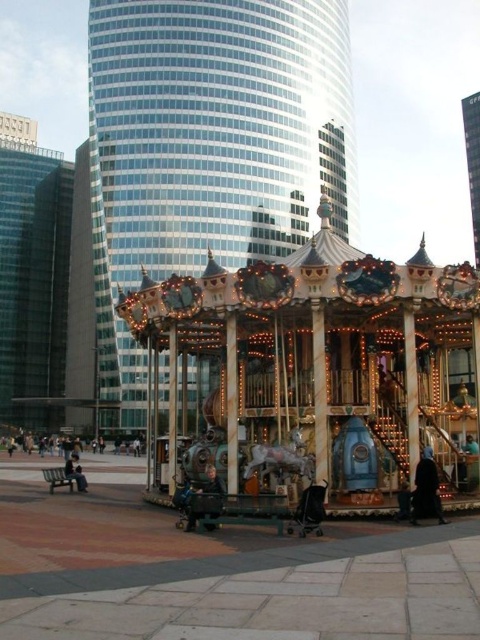
Question: Which object is positioned farthest from the dark blue fabric chair at center?

Choices:
 (A) dark blue jeans at lower left
 (B) wooden carousel at center
 (C) black fur coat at lower right
 (D) glassy skyscraper at left

Answer: (D)

Question: Is the position of glassy skyscraper at left less distant than that of dark blue fabric chair at center?

Choices:
 (A) no
 (B) yes

Answer: (A)

Question: Among these points, which one is farthest from the camera?

Choices:
 (A) (260, 403)
 (B) (67, 284)

Answer: (B)

Question: Is the position of glassy steel tower at center less distant than that of glassy skyscraper at left?

Choices:
 (A) no
 (B) yes

Answer: (B)

Question: Can you confirm if glassy steel tower at center is smaller than wooden carousel at center?

Choices:
 (A) no
 (B) yes

Answer: (A)

Question: Which object appears farthest from the camera in this image?

Choices:
 (A) dark blue jeans at lower left
 (B) glassy steel tower at center
 (C) dark blue fabric chair at center

Answer: (B)